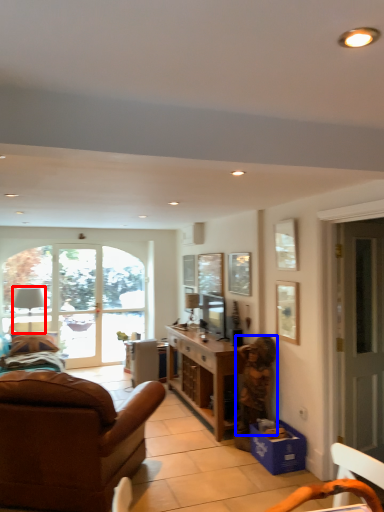
Question: Among these objects, which one is farthest to the camera, lamp (highlighted by a red box) or person (highlighted by a blue box)?

Choices:
 (A) lamp
 (B) person

Answer: (A)